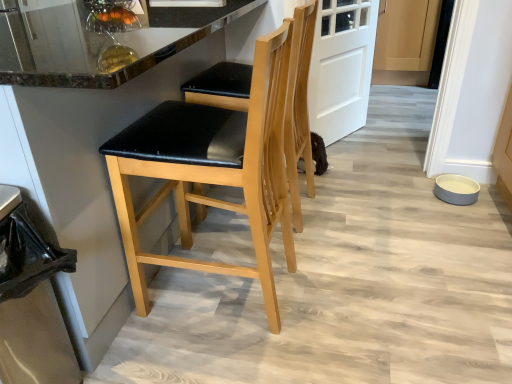
Question: Is white matte door at center smaller than light wood cabinet at center?

Choices:
 (A) yes
 (B) no

Answer: (A)

Question: Does white matte door at center have a greater height compared to light wood cabinet at center?

Choices:
 (A) yes
 (B) no

Answer: (A)

Question: Does white matte door at center have a lesser height compared to light wood cabinet at center?

Choices:
 (A) no
 (B) yes

Answer: (A)

Question: Is the position of white matte door at center more distant than that of light wood cabinet at center?

Choices:
 (A) yes
 (B) no

Answer: (B)

Question: Is white matte door at center positioned beyond the bounds of light wood cabinet at center?

Choices:
 (A) yes
 (B) no

Answer: (A)

Question: Considering the positions of gray matte bowl at lower right and light wood cabinet at center in the image, is gray matte bowl at lower right taller or shorter than light wood cabinet at center?

Choices:
 (A) tall
 (B) short

Answer: (B)

Question: From the image's perspective, is gray matte bowl at lower right positioned above or below light wood cabinet at center?

Choices:
 (A) below
 (B) above

Answer: (A)

Question: Is gray matte bowl at lower right inside the boundaries of light wood cabinet at center, or outside?

Choices:
 (A) inside
 (B) outside

Answer: (B)

Question: Is gray matte bowl at lower right wider or thinner than light wood cabinet at center?

Choices:
 (A) wide
 (B) thin

Answer: (B)

Question: Would you say black plastic trash can at lower left is to the left or to the right of matte black seat at center, placed as the 2th chair when sorted from front to back, in the picture?

Choices:
 (A) left
 (B) right

Answer: (A)

Question: Looking at their shapes, would you say black plastic trash can at lower left is wider or thinner than matte black seat at center, placed as the first chair when sorted from back to front?

Choices:
 (A) wide
 (B) thin

Answer: (B)

Question: From the image's perspective, is black plastic trash can at lower left above or below matte black seat at center, placed as the first chair when sorted from back to front?

Choices:
 (A) below
 (B) above

Answer: (A)

Question: Is black plastic trash can at lower left inside the boundaries of matte black seat at center, placed as the 2th chair when sorted from front to back, or outside?

Choices:
 (A) outside
 (B) inside

Answer: (A)

Question: Is gray matte bowl at lower right inside or outside of black leather stool at left?

Choices:
 (A) outside
 (B) inside

Answer: (A)

Question: Considering the positions of gray matte bowl at lower right and black leather stool at left in the image, is gray matte bowl at lower right wider or thinner than black leather stool at left?

Choices:
 (A) thin
 (B) wide

Answer: (A)